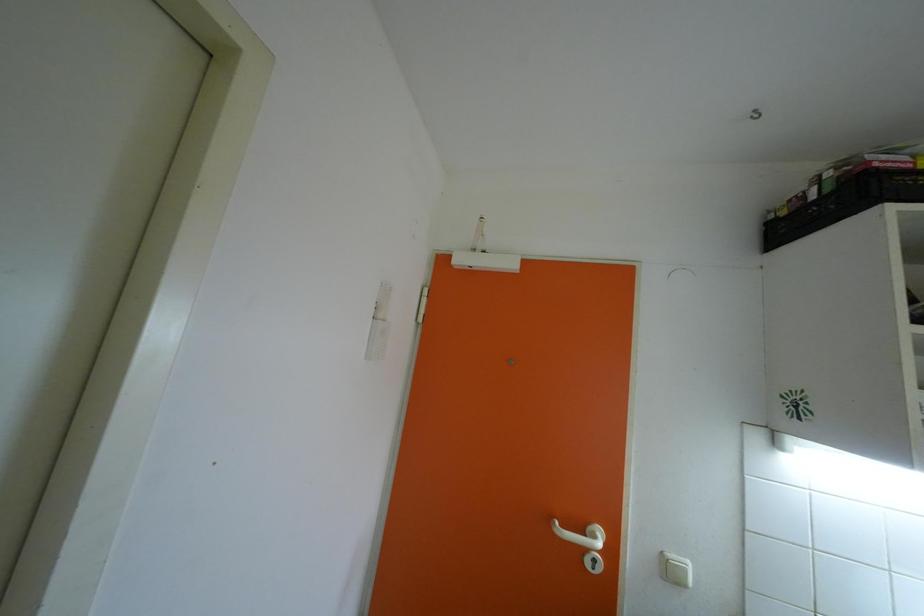
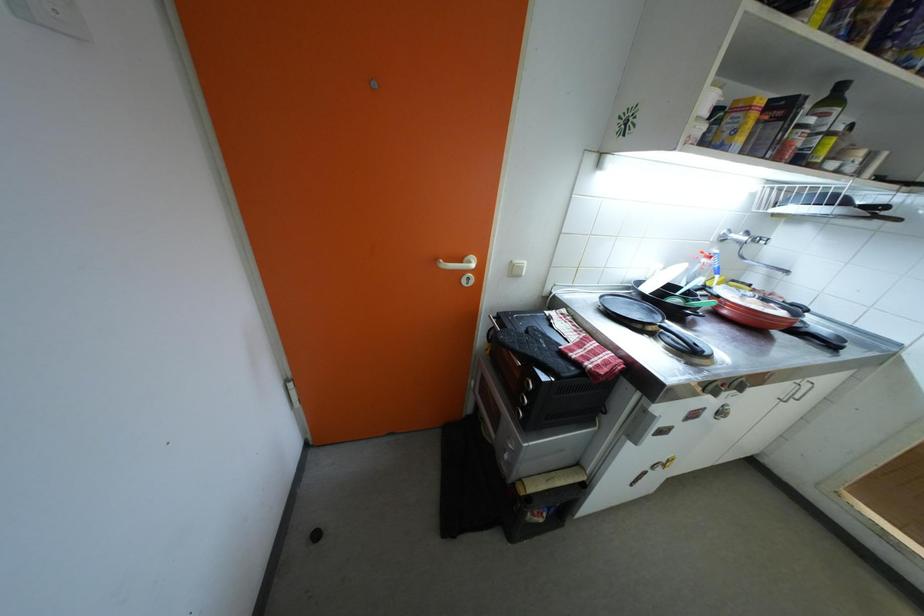
The images are taken continuously from a first-person perspective. In which direction is your viewpoint rotating?

The camera's rotation is toward right-down.